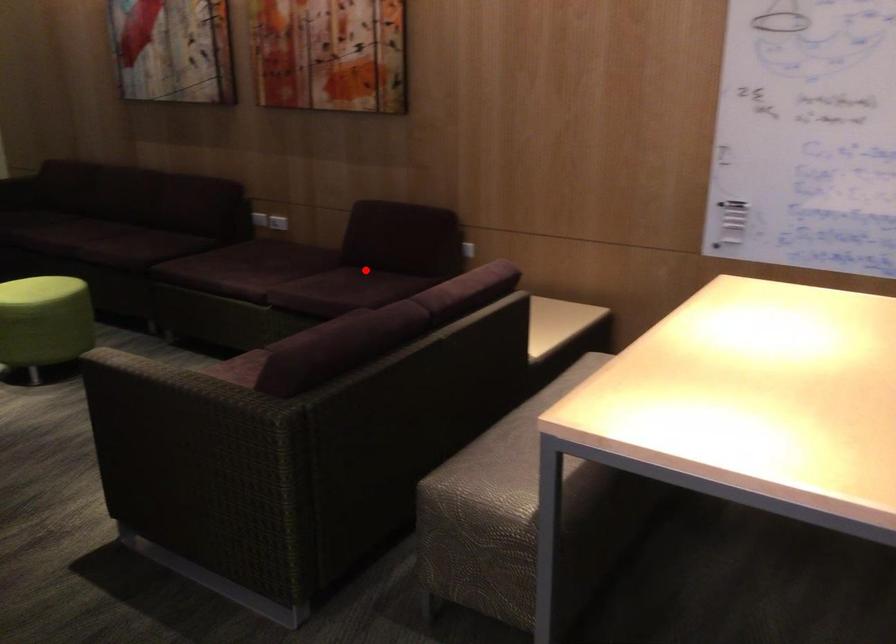
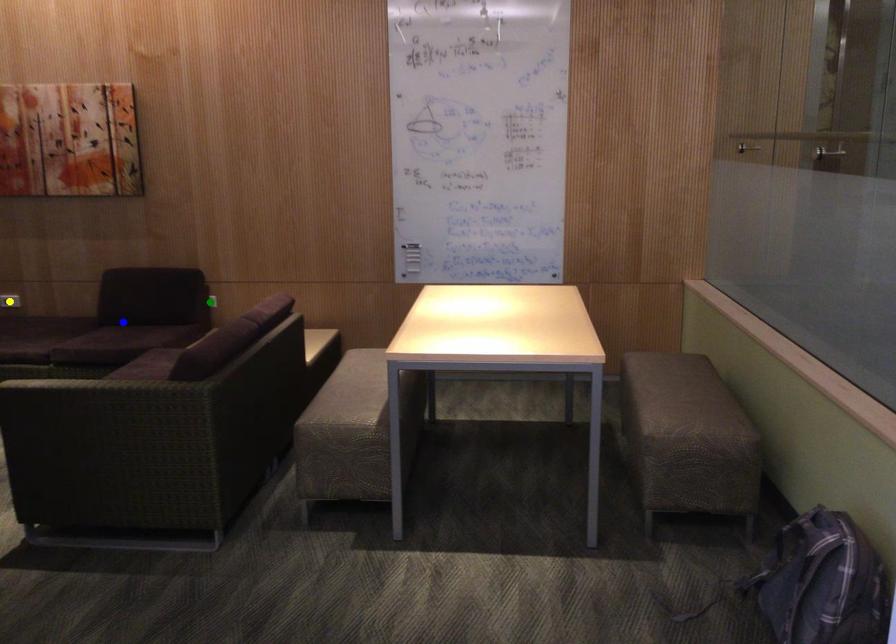
Question: I am providing you with two images of the same scene from different viewpoints. A red point is marked on the first image. You are given multiple points on the second image. In image 2, which mark is for the same physical point as the one in image 1?

Choices:
 (A) blue point
 (B) yellow point
 (C) green point

Answer: (A)